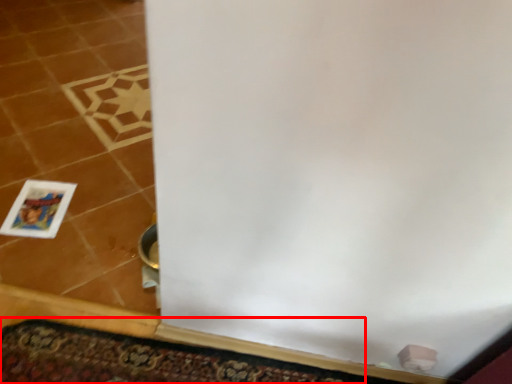
Question: From the image's perspective, considering the relative positions of doormat (annotated by the red box) and picture frame in the image provided, where is doormat (annotated by the red box) located with respect to the staircase?

Choices:
 (A) above
 (B) below

Answer: (B)